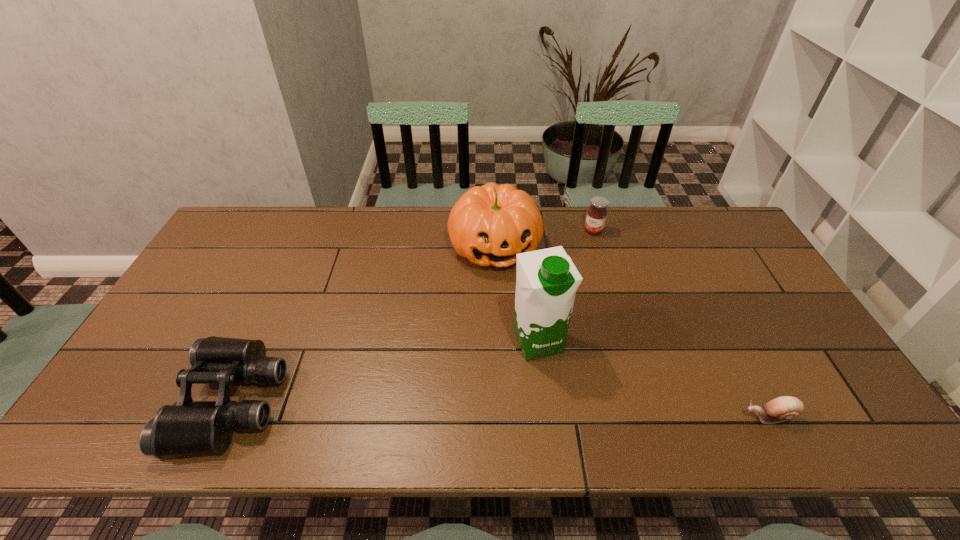
The image size is (960, 540). Find the location of `binoculars`. binoculars is located at coordinates (188, 427).

In order to click on escargot in this screenshot , I will do `click(783, 408)`.

The width and height of the screenshot is (960, 540). I want to click on the rightmost object, so click(x=783, y=408).

At what (x,y) coordinates should I click in order to perform the action: click on the second tallest object. Please return your answer as a coordinate pair (x, y). Looking at the image, I should click on (489, 225).

Identify the location of soya milk. (547, 280).

Locate an element on the screen. The image size is (960, 540). the second object from right to left is located at coordinates click(596, 216).

Find the location of a particular element. The height and width of the screenshot is (540, 960). free location located on the front-facing side of the leftmost object is located at coordinates (124, 401).

Image resolution: width=960 pixels, height=540 pixels. In order to click on free spot located on the front-facing side of the leftmost object in this screenshot , I will do `click(116, 401)`.

Find the location of a particular element. free location located 0.230m on the carved face of the fourth shortest object is located at coordinates 526,336.

The image size is (960, 540). In order to click on free location located 0.240m on the carved face of the fourth shortest object in this screenshot , I will do `click(527, 339)`.